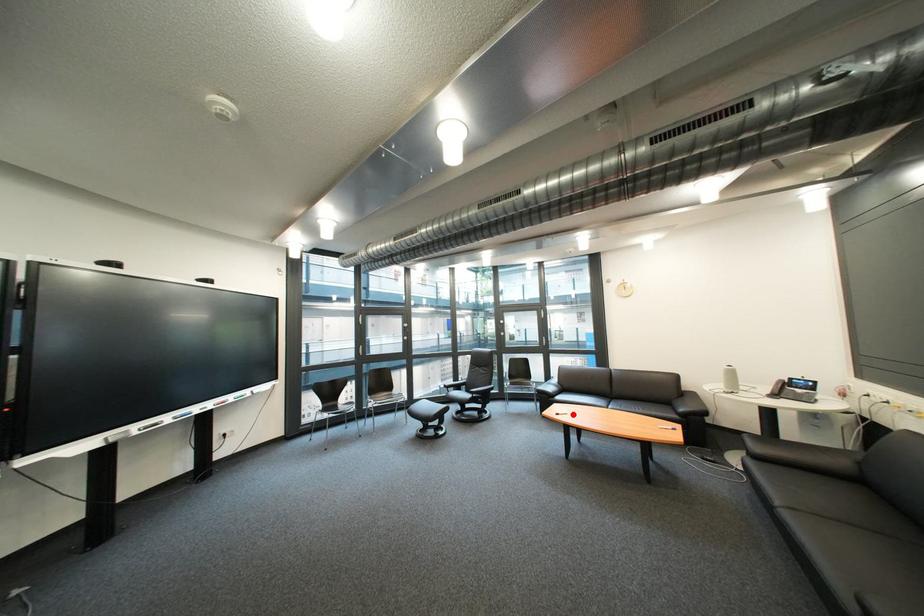
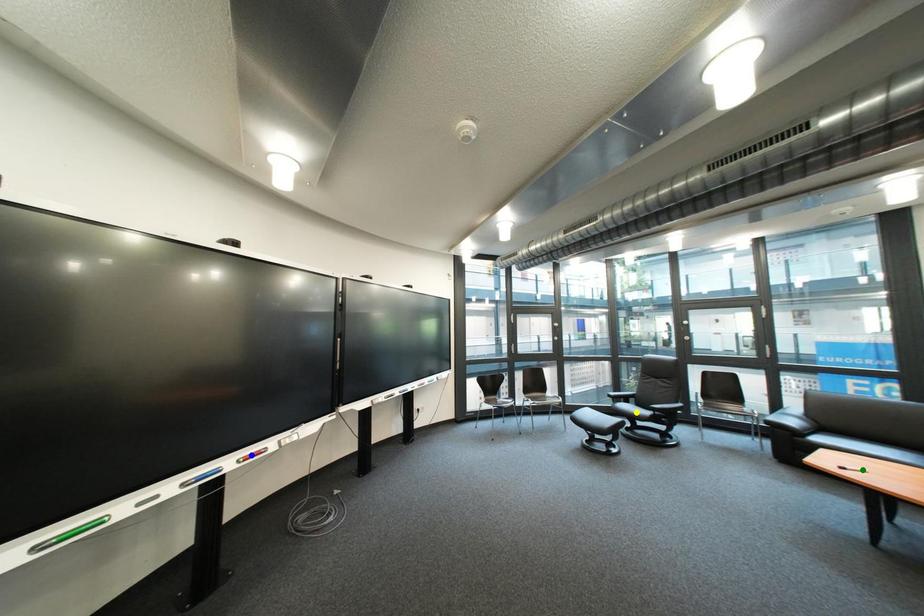
Question: I am providing you with two images of the same scene from different viewpoints. A red point is marked on the first image. You are given multiple points on the second image. Can you choose the point in image 2 that corresponds to the point in image 1?

Choices:
 (A) green point
 (B) blue point
 (C) yellow point

Answer: (A)